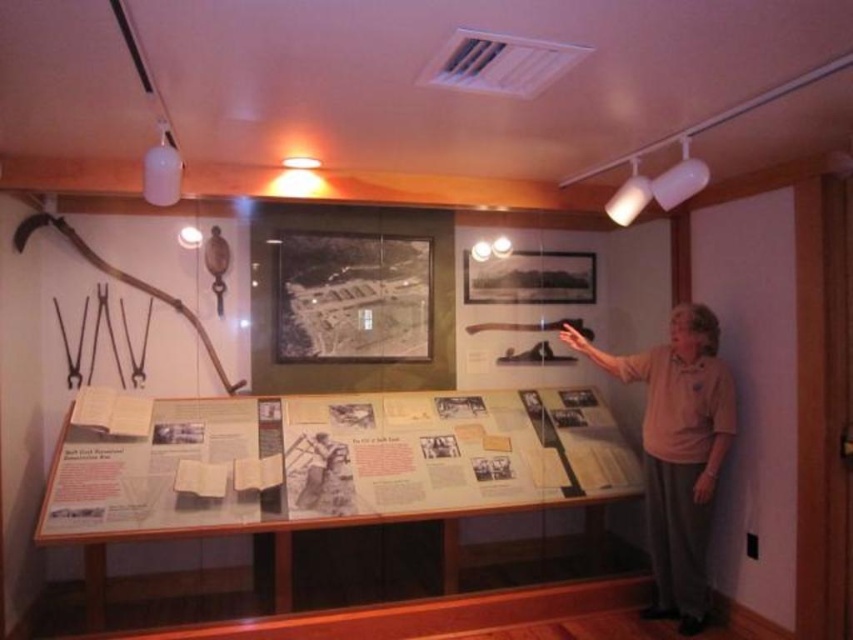
Question: Which of the following is the closest to the observer?

Choices:
 (A) white paper at center
 (B) pink cotton shirt at right

Answer: (A)

Question: In this image, where is pink cotton shirt at right located relative to white paper at center?

Choices:
 (A) above
 (B) below

Answer: (A)

Question: Does pink cotton shirt at right lie in front of white paper at center?

Choices:
 (A) yes
 (B) no

Answer: (B)

Question: Which of the following is the farthest from the observer?

Choices:
 (A) pink cotton shirt at right
 (B) white paper at center

Answer: (A)

Question: Can you confirm if pink cotton shirt at right is smaller than white paper at center?

Choices:
 (A) no
 (B) yes

Answer: (A)

Question: Which of the following is the closest to the observer?

Choices:
 (A) white paper at center
 (B) pink cotton shirt at right

Answer: (A)